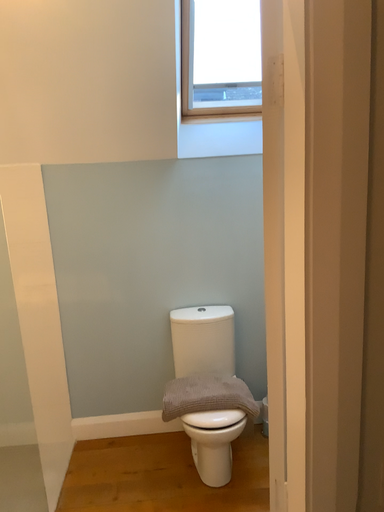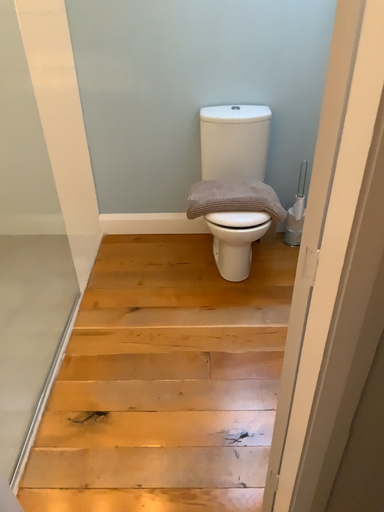
Question: Which way did the camera rotate in the video?

Choices:
 (A) rotated upward
 (B) rotated downward

Answer: (B)